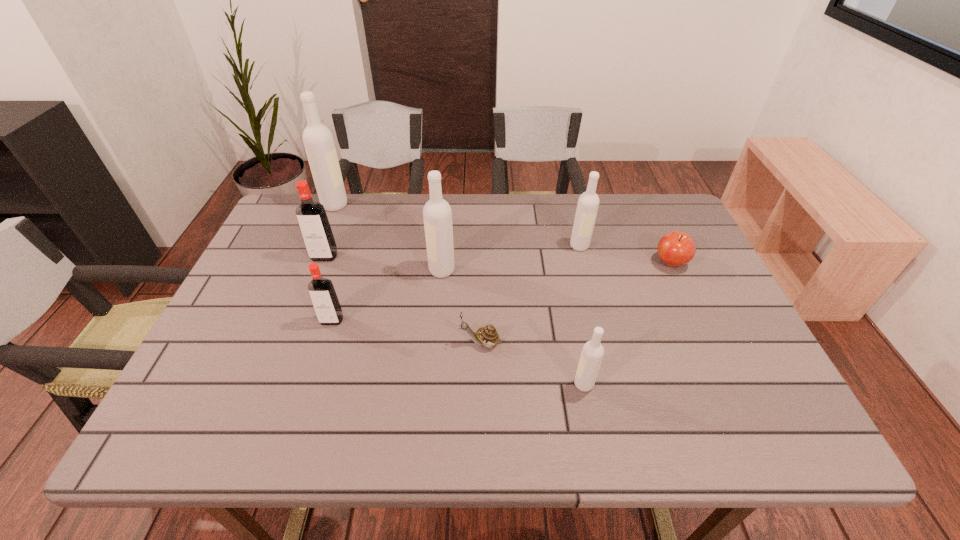
This screenshot has height=540, width=960. I want to click on vacant region that satisfies the following two spatial constraints: 1. on the front side of the tallest object; 2. on the left side of the rightmost vodka, so click(319, 246).

You are a GUI agent. You are given a task and a screenshot of the screen. Output one action in this format:
    pyautogui.click(x=<x>, y=<y>)
    Task: Click on the vacant space that satisfies the following two spatial constraints: 1. on the front side of the rightmost object; 2. on the face of the fifth object from left to right
    This screenshot has width=960, height=540.
    Given the screenshot: What is the action you would take?
    pyautogui.click(x=708, y=343)

You are a GUI agent. You are given a task and a screenshot of the screen. Output one action in this format:
    pyautogui.click(x=<x>, y=<y>)
    Task: Click on the vacant space that satisfies the following two spatial constraints: 1. on the front and back of the nearest object; 2. on the right side of the left red vodka
    
    Given the screenshot: What is the action you would take?
    pyautogui.click(x=276, y=384)